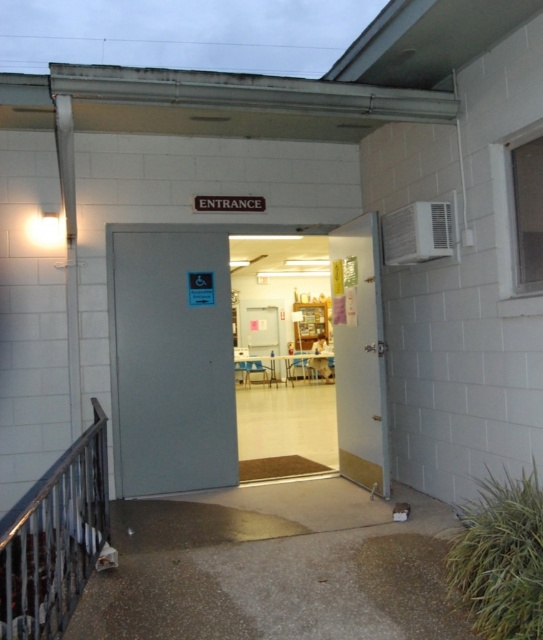
Question: Which of the following is the closest to the observer?

Choices:
 (A) gray metallic door at center
 (B) metallic gray balustrade at lower left
 (C) gold metallic door at center
 (D) gray matte door at center

Answer: (B)

Question: Does gray metallic door at center come behind gray matte door at center?

Choices:
 (A) no
 (B) yes

Answer: (A)

Question: Does gray metallic door at center have a smaller size compared to gray matte door at center?

Choices:
 (A) no
 (B) yes

Answer: (A)

Question: Among these objects, which one is nearest to the camera?

Choices:
 (A) gray metallic door at center
 (B) metallic gray balustrade at lower left
 (C) gold metallic door at center

Answer: (B)

Question: Which point appears farthest from the camera in this image?

Choices:
 (A) (12, 576)
 (B) (146, 410)
 (C) (388, 436)
 (D) (380, 340)

Answer: (B)

Question: Is gray matte door at center to the left of gold metallic door at center from the viewer's perspective?

Choices:
 (A) no
 (B) yes

Answer: (B)